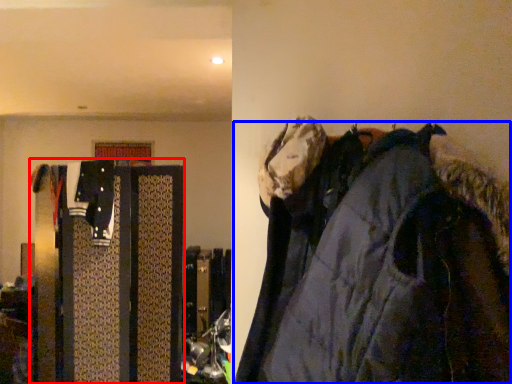
Question: Which point is further to the camera, closet (highlighted by a red box) or jacket (highlighted by a blue box)?

Choices:
 (A) closet
 (B) jacket

Answer: (A)